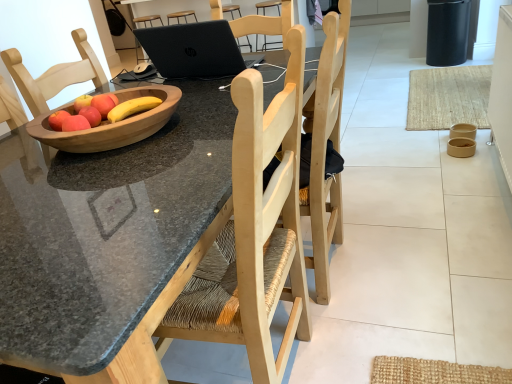
You are a GUI agent. You are given a task and a screenshot of the screen. Output one action in this format:
    pyautogui.click(x=<x>, y=<y>)
    Task: Click on the free spot in front of brown paper bowl at lower right, which is the second bowl from left to right
    The width and height of the screenshot is (512, 384).
    Given the screenshot: What is the action you would take?
    pyautogui.click(x=474, y=167)